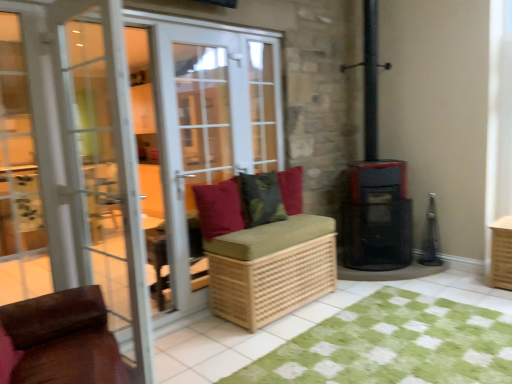
You are a GUI agent. You are given a task and a screenshot of the screen. Output one action in this format:
    pyautogui.click(x=<x>, y=<y>)
    Task: Click on the vacant space in front of green textured cushion at center, placed as the 2th pillow when sorted from right to left
    The height and width of the screenshot is (384, 512).
    Given the screenshot: What is the action you would take?
    click(x=263, y=230)